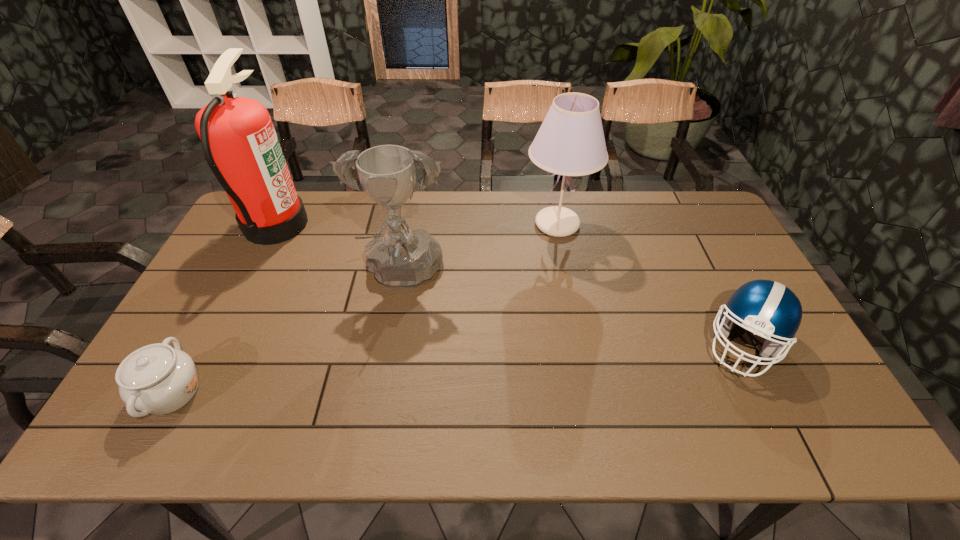
This screenshot has width=960, height=540. Identify the location of the tallest object. (238, 138).

This screenshot has height=540, width=960. I want to click on the fourth object from left to right, so click(570, 142).

What are the coordinates of `the third object from left to right` in the screenshot? It's located at (400, 258).

Image resolution: width=960 pixels, height=540 pixels. I want to click on football helmet, so click(x=766, y=308).

The height and width of the screenshot is (540, 960). Identify the location of the second shortest object. (766, 308).

Find the location of a particular element. Image resolution: width=960 pixels, height=540 pixels. the shortest object is located at coordinates (156, 379).

Locate an element on the screen. The image size is (960, 540). free space located 0.340m at the nozzle of the tallest object is located at coordinates (406, 224).

Identify the location of vacant point located on the right of the lampshade. The image size is (960, 540). (708, 224).

Find the location of a particular element. The height and width of the screenshot is (540, 960). vacant space located 0.250m on the side with emblem of the third object from right to left is located at coordinates (382, 393).

In order to click on free space located at the front of the football helmet with the faceguard in this screenshot , I will do 777,409.